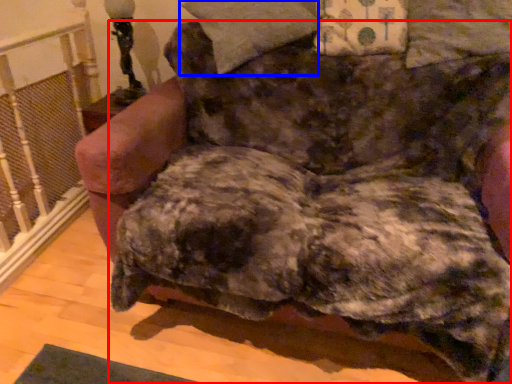
Question: Which object appears closest to the camera in this image, dog (highlighted by a red box) or pillow (highlighted by a blue box)?

Choices:
 (A) dog
 (B) pillow

Answer: (A)